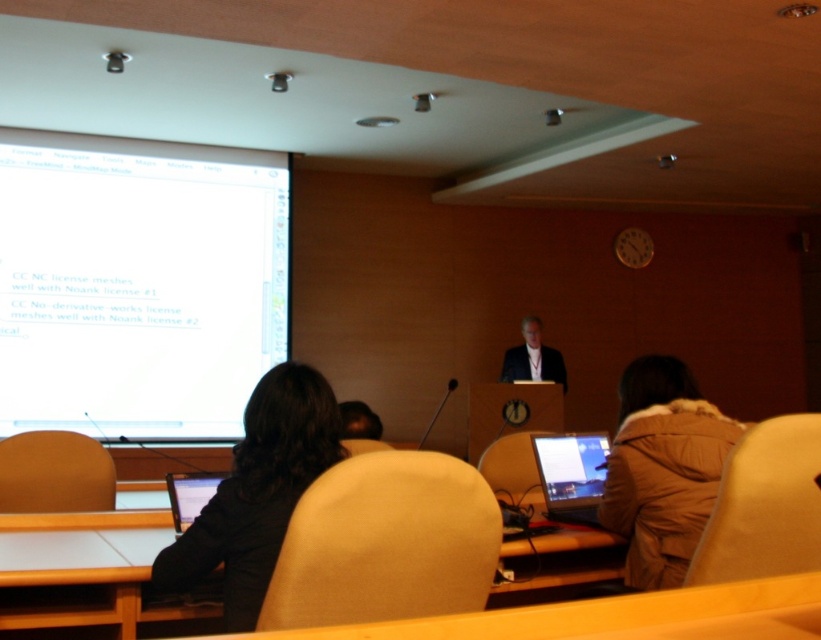
You are sitting in the audience of the presentation and need to quickly grab your matte black laptop at lower left. Since you are currently sitting on the matte brown chair at lower left, can you reach your laptop without moving from your seat?

The matte brown chair at lower left is to the left of the matte black laptop at lower left, so you can reach your matte black laptop at lower left without needing to move from your seat as it is positioned to the right of your current seating position.

You are standing at the entrance of the lecture hall and want to sit in the matte brown chair at lower left. Based on its 2D coordinates, which direction should you walk to reach it?

The matte brown chair at lower left is located at coordinates point [54,474]. Since the y coordinate is very low, this indicates it is near the front of the room. Therefore, you should walk forward towards the front of the room to reach the matte brown chair at lower left.